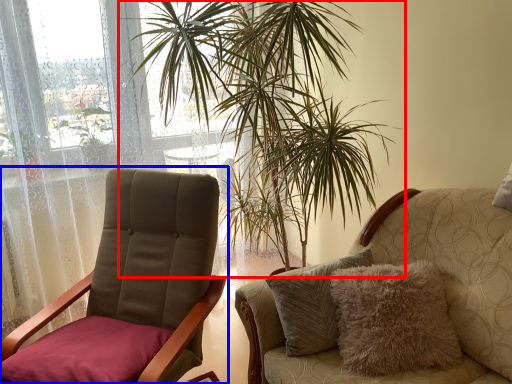
Question: Which object is closer to the camera taking this photo, houseplant (highlighted by a red box) or chair (highlighted by a blue box)?

Choices:
 (A) houseplant
 (B) chair

Answer: (B)